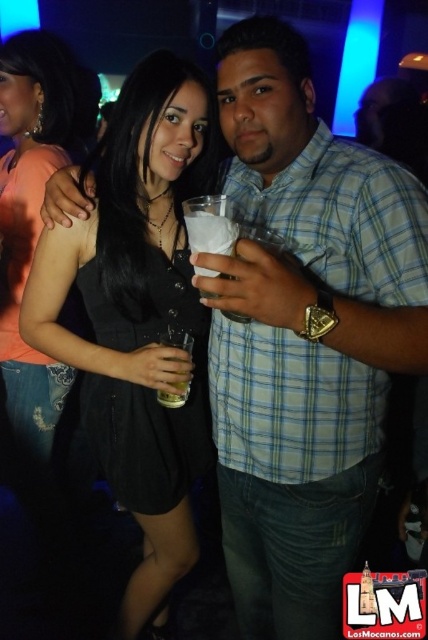
Who is lower down, black matte dress at center or clear plastic cup at center?

black matte dress at center

You are a GUI agent. You are given a task and a screenshot of the screen. Output one action in this format:
    pyautogui.click(x=<x>, y=<y>)
    Task: Click on the black matte dress at center
    The image size is (428, 640).
    Given the screenshot: What is the action you would take?
    139,316

Between point (228, 259) and point (142, 253), which one is positioned in front?

Positioned in front is point (228, 259).

Between point (270, 20) and point (187, 317), which one is positioned in front?

Point (270, 20) is in front.

Find the location of a particular element. The height and width of the screenshot is (640, 428). blue plaid shirt at center is located at coordinates (303, 333).

Is blue plaid shirt at center smaller than clear plastic cup at center?

Actually, blue plaid shirt at center might be larger than clear plastic cup at center.

Who is more forward, [413,358] or [201,216]?

Positioned in front is point [413,358].

Where is `blue plaid shirt at center`? Image resolution: width=428 pixels, height=640 pixels. blue plaid shirt at center is located at coordinates (303, 333).